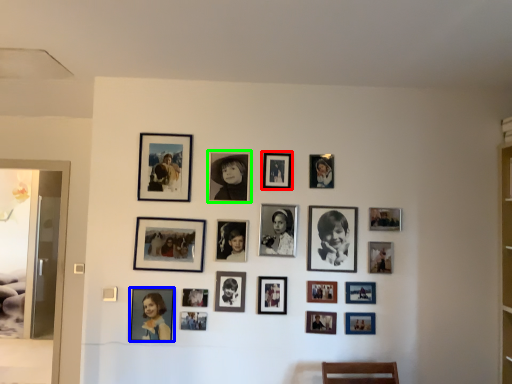
Question: Estimate the real-world distances between objects in this image. Which object is closer to picture frame (highlighted by a red box), picture frame (highlighted by a blue box) or picture frame (highlighted by a green box)?

Choices:
 (A) picture frame
 (B) picture frame

Answer: (B)